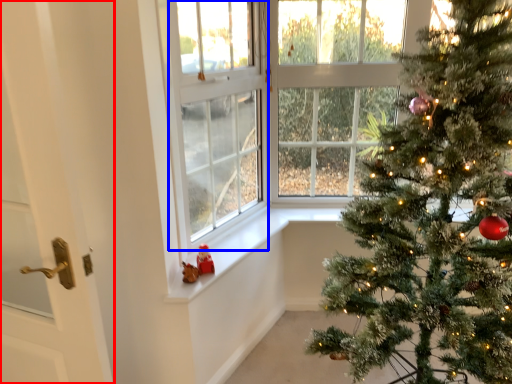
Question: Which point is further to the camera, door (highlighted by a red box) or window screen (highlighted by a blue box)?

Choices:
 (A) door
 (B) window screen

Answer: (B)